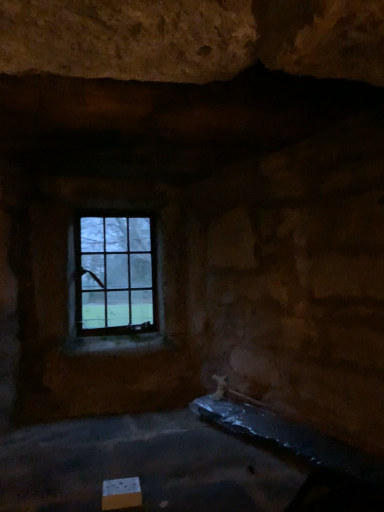
From the picture: What is the approximate width of white cardboard box at lower left?

white cardboard box at lower left is 4.05 inches wide.

What do you see at coordinates (121, 493) in the screenshot? I see `white cardboard box at lower left` at bounding box center [121, 493].

Locate an element on the screen. The height and width of the screenshot is (512, 384). white cardboard box at lower left is located at coordinates (121, 493).

The height and width of the screenshot is (512, 384). I want to click on clear glass window at upper center, so click(x=115, y=273).

Describe the element at coordinates (115, 273) in the screenshot. I see `clear glass window at upper center` at that location.

At what (x,y) coordinates should I click in order to perform the action: click on white cardboard box at lower left. Please return your answer as a coordinate pair (x, y). Image resolution: width=384 pixels, height=512 pixels. Looking at the image, I should click on pyautogui.click(x=121, y=493).

Does clear glass window at upper center appear on the left side of white cardboard box at lower left?

Yes.

In the image, is clear glass window at upper center positioned in front of or behind white cardboard box at lower left?

Clearly, clear glass window at upper center is behind white cardboard box at lower left.

Which is in front, point (150, 292) or point (103, 497)?

Point (103, 497)

From the image's perspective, between clear glass window at upper center and white cardboard box at lower left, who is located below?

white cardboard box at lower left.

From a real-world perspective, between clear glass window at upper center and white cardboard box at lower left, who is vertically higher?

clear glass window at upper center, from a real-world perspective.

Looking at their sizes, would you say clear glass window at upper center is wider or thinner than white cardboard box at lower left?

Clearly, clear glass window at upper center has less width compared to white cardboard box at lower left.

Considering the relative sizes of clear glass window at upper center and white cardboard box at lower left in the image provided, is clear glass window at upper center shorter than white cardboard box at lower left?

No.

Is clear glass window at upper center bigger or smaller than white cardboard box at lower left?

Clearly, clear glass window at upper center is larger in size than white cardboard box at lower left.

From the picture: Is clear glass window at upper center spatially inside white cardboard box at lower left, or outside of it?

clear glass window at upper center is located beyond the bounds of white cardboard box at lower left.

Are clear glass window at upper center and white cardboard box at lower left located far from each other?

Absolutely, clear glass window at upper center is distant from white cardboard box at lower left.

Is clear glass window at upper center turned away from white cardboard box at lower left?

No.

How different are the orientations of clear glass window at upper center and white cardboard box at lower left in degrees?

They differ by 0.000722 degrees in their facing directions.

Where is `cardboard box located on the right of clear glass window at upper center`? cardboard box located on the right of clear glass window at upper center is located at coordinates (121, 493).

From the picture: Is white cardboard box at lower left at the right side of clear glass window at upper center?

Indeed, white cardboard box at lower left is positioned on the right side of clear glass window at upper center.

Between white cardboard box at lower left and clear glass window at upper center, which one is positioned in front?

white cardboard box at lower left is more forward.

Is point (122, 507) positioned in front of point (125, 325)?

Yes, it is.

From the image's perspective, who appears lower, white cardboard box at lower left or clear glass window at upper center?

white cardboard box at lower left is shown below in the image.

From a real-world perspective, who is located lower, white cardboard box at lower left or clear glass window at upper center?

white cardboard box at lower left is physically lower.

Which of these two, white cardboard box at lower left or clear glass window at upper center, is thinner?

Thinner between the two is clear glass window at upper center.

Which of these two, white cardboard box at lower left or clear glass window at upper center, stands taller?

Standing taller between the two is clear glass window at upper center.

Based on their sizes in the image, would you say white cardboard box at lower left is bigger or smaller than clear glass window at upper center?

Clearly, white cardboard box at lower left is smaller in size than clear glass window at upper center.

Can we say white cardboard box at lower left lies outside clear glass window at upper center?

Yes.

Is white cardboard box at lower left placed right next to clear glass window at upper center?

No, white cardboard box at lower left is not beside clear glass window at upper center.

Is white cardboard box at lower left turned away from clear glass window at upper center?

That's not correct — white cardboard box at lower left is not looking away from clear glass window at upper center.

Identify the location of cardboard box that appears below the clear glass window at upper center (from a real-world perspective). The image size is (384, 512). (121, 493).

Identify the location of cardboard box in front of the clear glass window at upper center. The width and height of the screenshot is (384, 512). (121, 493).

Locate an element on the screen. cardboard box that is under the clear glass window at upper center (from a real-world perspective) is located at coordinates (121, 493).